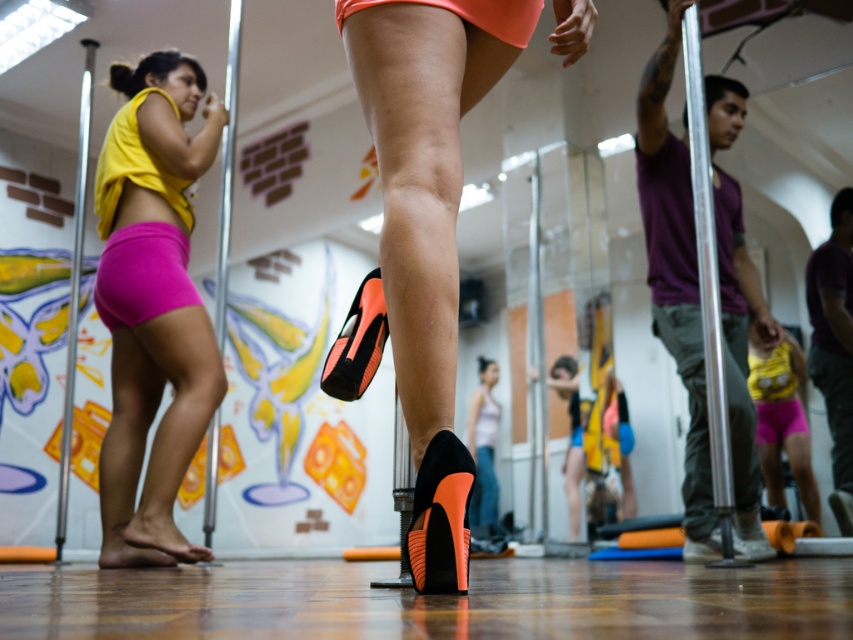
Question: Is pink fabric shorts at left further to camera compared to orange matte high-heeled shoe at center?

Choices:
 (A) no
 (B) yes

Answer: (B)

Question: Which point is closer to the camera taking this photo?

Choices:
 (A) (339, 19)
 (B) (474, 90)
 (C) (166, 227)
 (D) (376, 339)

Answer: (A)

Question: Is pink fabric shorts at left bigger than purple fabric underwear at lower center?

Choices:
 (A) yes
 (B) no

Answer: (A)

Question: Which point is farther to the camera?

Choices:
 (A) (184, 61)
 (B) (166, 273)
 (C) (758, 412)
 (D) (457, 522)

Answer: (C)

Question: Based on their relative distances, which object is farther from the matte black high-heeled shoe at center?

Choices:
 (A) suede high-heeled shoe at center
 (B) black suede high-heeled shoe at lower center
 (C) pink fabric shorts at left

Answer: (C)

Question: Is suede high-heeled shoe at center thinner than pink fabric shorts at lower left?

Choices:
 (A) no
 (B) yes

Answer: (A)